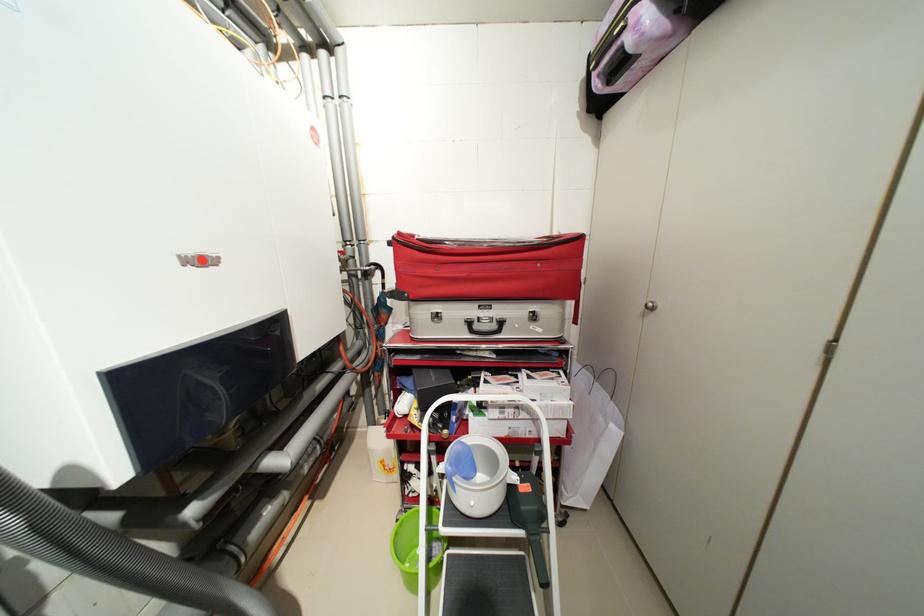
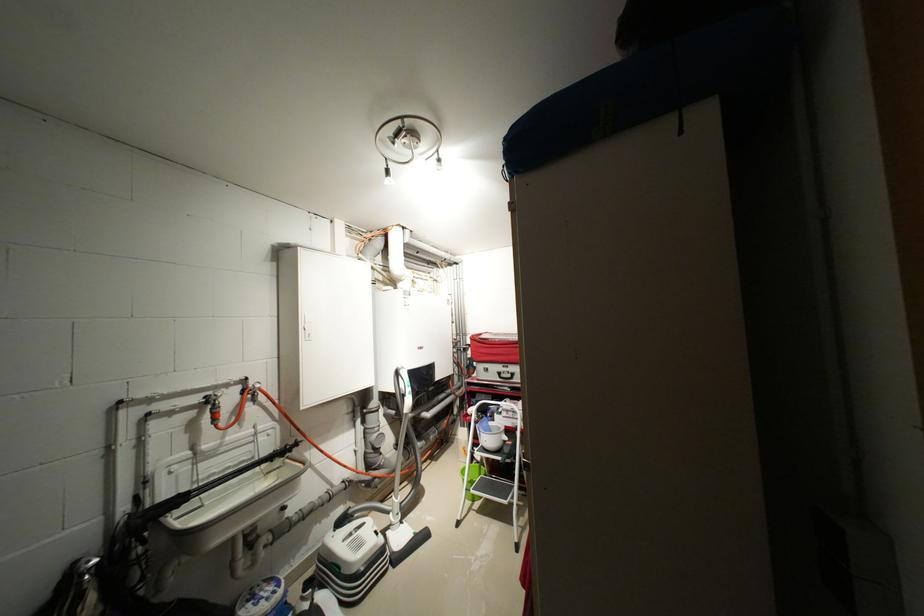
Question: I am providing you with two images of the same scene from different viewpoints. After the viewpoint changes to image2, which objects are now occluded?

Choices:
 (A) red spigot handle
 (B) white bucket handle
 (C) sprayer wand trigger
 (D) none of these

Answer: (D)